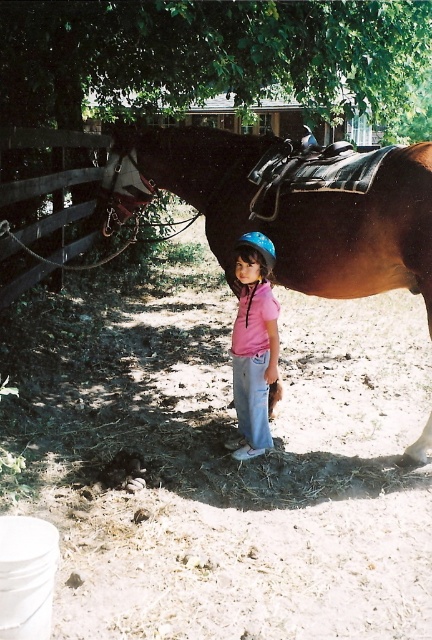
Question: Which is nearer to the blue matte helmet at center?

Choices:
 (A) brown leather saddle at upper center
 (B) pink matte helmet at center

Answer: (B)

Question: Considering the relative positions of green leafy tree at upper center and brown leather saddle at upper center in the image provided, where is green leafy tree at upper center located with respect to brown leather saddle at upper center?

Choices:
 (A) right
 (B) left

Answer: (A)

Question: Which point is closer to the camera taking this photo?

Choices:
 (A) (238, 72)
 (B) (245, 396)
 (C) (76, 256)
 (D) (275, 256)

Answer: (D)

Question: Does brown leather saddle at upper center lie in front of brown wooden fence at left?

Choices:
 (A) yes
 (B) no

Answer: (A)

Question: Among these points, which one is farthest from the camera?

Choices:
 (A) (237, 371)
 (B) (245, 33)

Answer: (B)

Question: Is brown wooden fence at left to the right of blue matte helmet at center from the viewer's perspective?

Choices:
 (A) yes
 (B) no

Answer: (B)